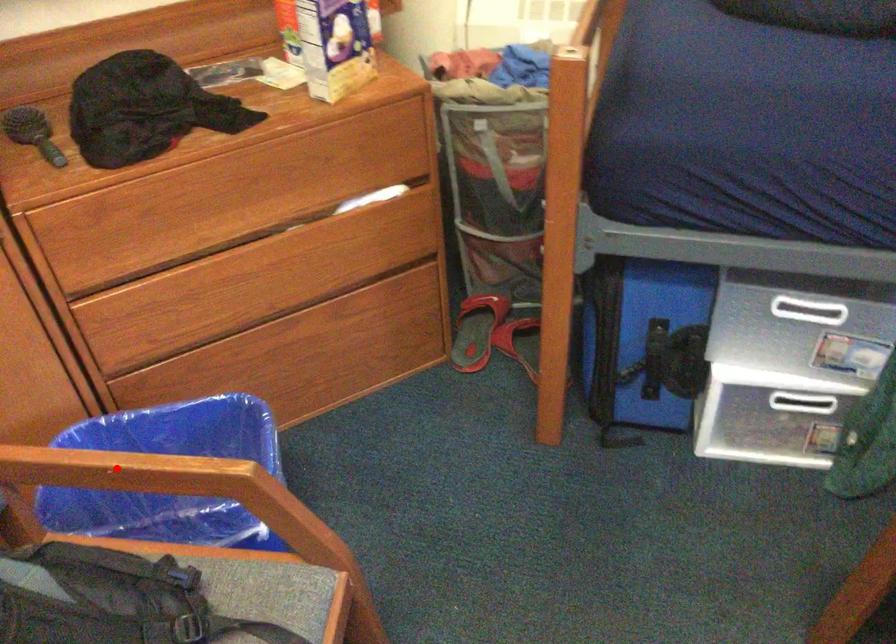
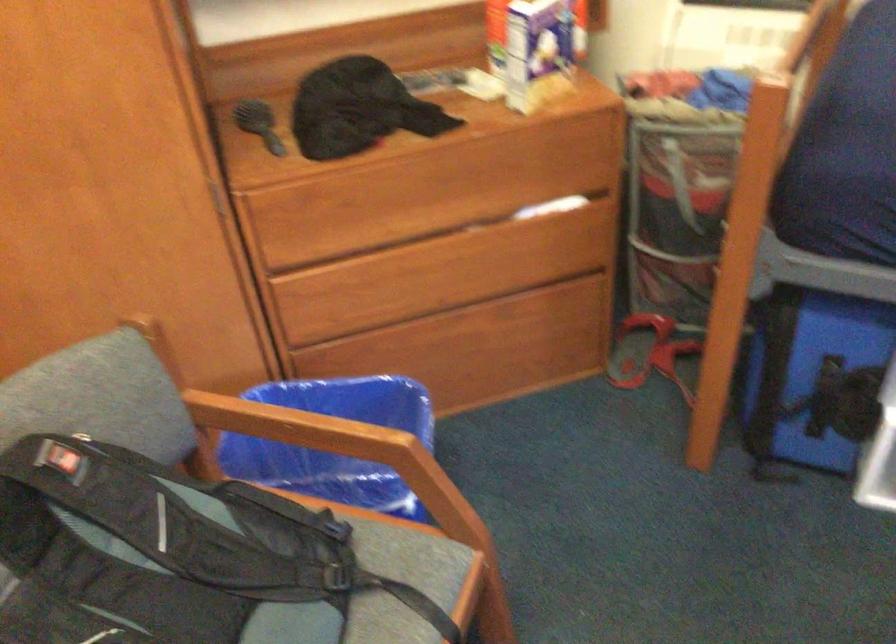
The point at the highlighted location is marked in the first image. Where is the corresponding point in the second image?

(290, 424)